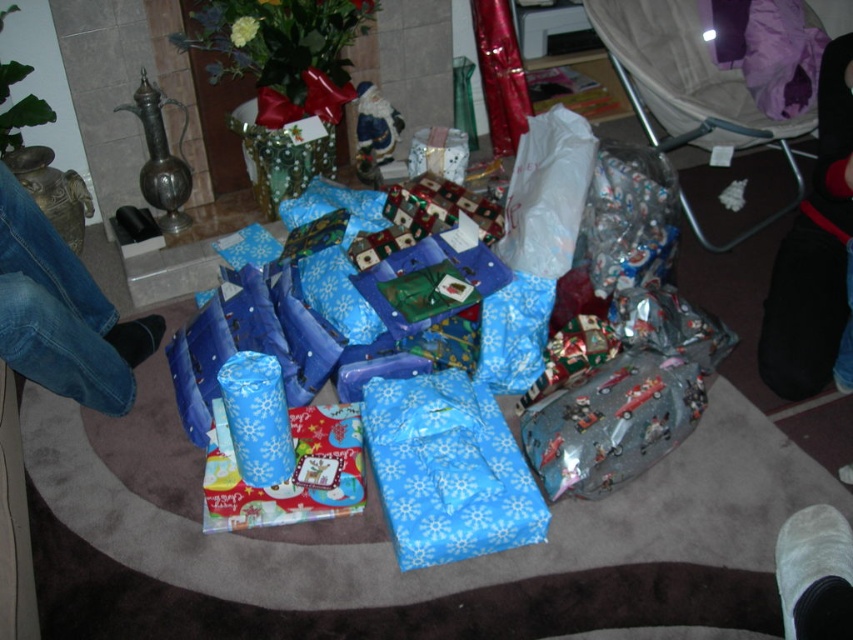
Does blue paper wrapped gift at center appear over blue fabric sock at lower left?

Actually, blue paper wrapped gift at center is below blue fabric sock at lower left.

Can you confirm if blue paper wrapped gift at center is positioned below blue fabric sock at lower left?

Indeed, blue paper wrapped gift at center is positioned under blue fabric sock at lower left.

Between point (503, 468) and point (143, 317), which one is positioned in front?

Point (503, 468) is more forward.

Identify the location of blue paper wrapped gift at center. (448, 468).

Measure the distance between blue jeans at left and blue fabric sock at lower left.

blue jeans at left and blue fabric sock at lower left are 7.60 inches apart.

What do you see at coordinates (62, 312) in the screenshot? Image resolution: width=853 pixels, height=640 pixels. I see `blue jeans at left` at bounding box center [62, 312].

Is point (42, 316) in front of point (141, 360)?

Yes.

Find the location of a particular element. blue jeans at left is located at coordinates (62, 312).

Is blue paper wrapped gift at center closer to the viewer compared to blue jeans at left?

No.

Does blue paper wrapped gift at center appear over blue jeans at left?

Actually, blue paper wrapped gift at center is below blue jeans at left.

You are a GUI agent. You are given a task and a screenshot of the screen. Output one action in this format:
    pyautogui.click(x=<x>, y=<y>)
    Task: Click on the blue paper wrapped gift at center
    Image resolution: width=853 pixels, height=640 pixels.
    Given the screenshot: What is the action you would take?
    pyautogui.click(x=448, y=468)

In order to click on blue paper wrapped gift at center in this screenshot , I will do `click(448, 468)`.